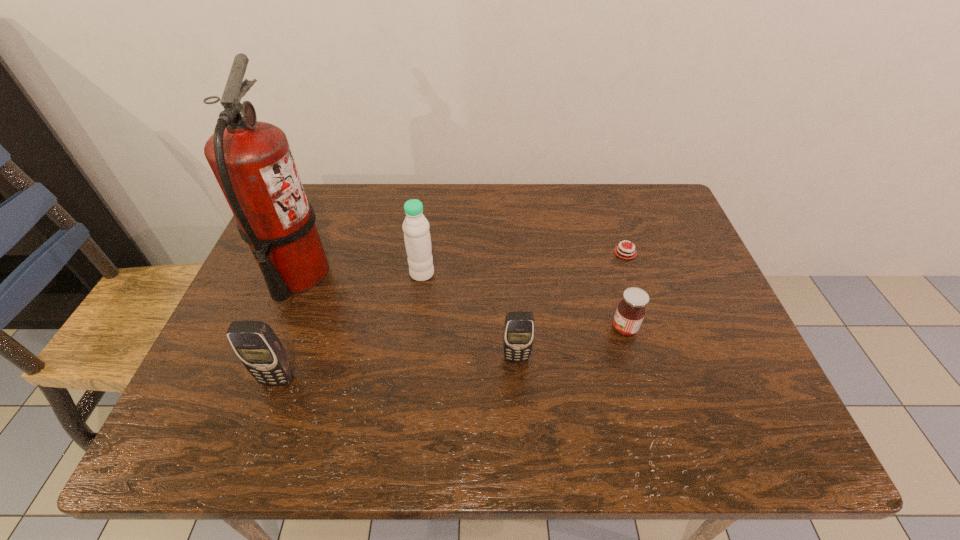
This screenshot has height=540, width=960. I want to click on object that is at the right edge, so click(x=622, y=251).

You are a GUI agent. You are given a task and a screenshot of the screen. Output one action in this format:
    pyautogui.click(x=<x>, y=<y>)
    Task: Click on the object at the near left corner
    The image size is (960, 540).
    Given the screenshot: What is the action you would take?
    pyautogui.click(x=260, y=350)

The width and height of the screenshot is (960, 540). I want to click on vacant space at the far edge of the desktop, so click(x=606, y=188).

The height and width of the screenshot is (540, 960). I want to click on vacant space at the near edge of the desktop, so click(x=612, y=370).

I want to click on free spot at the left edge of the desktop, so click(220, 367).

At what (x,y) coordinates should I click in order to perform the action: click on free space at the right edge of the desktop. Please return your answer as a coordinate pair (x, y). Looking at the image, I should click on (664, 310).

I want to click on vacant area at the far left corner of the desktop, so click(317, 186).

In the image, there is a desktop. Identify the location of blank space at the far right corner. (641, 221).

The height and width of the screenshot is (540, 960). Find the location of `vacant area between the left cellular telephone and the tallest object`. vacant area between the left cellular telephone and the tallest object is located at coordinates (287, 327).

Identify the location of free space between the tallest object and the second nearest object. This screenshot has width=960, height=540. (407, 315).